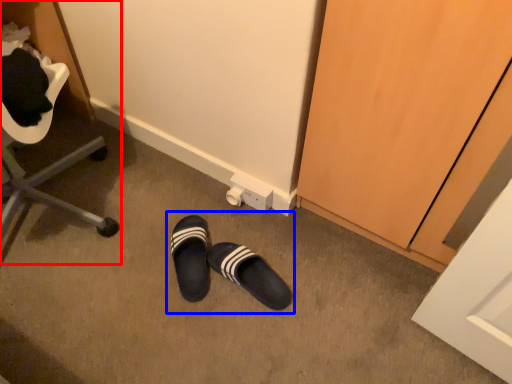
Question: Among these objects, which one is farthest to the camera, furniture (highlighted by a red box) or leather shoe (highlighted by a blue box)?

Choices:
 (A) furniture
 (B) leather shoe

Answer: (B)